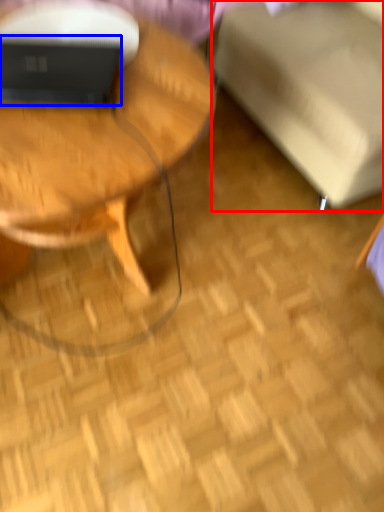
Question: Which object is closer to the camera taking this photo, swivel chair (highlighted by a red box) or laptop (highlighted by a blue box)?

Choices:
 (A) swivel chair
 (B) laptop

Answer: (A)